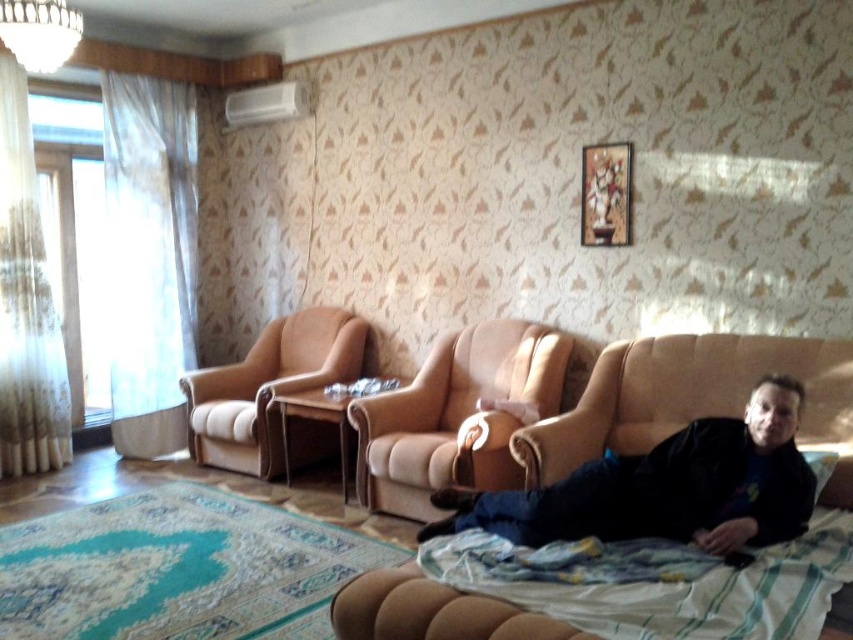
Question: Can you confirm if suede beige armchair at center is positioned to the right of beige fabric armchair at center?

Choices:
 (A) yes
 (B) no

Answer: (A)

Question: Which of the following is the farthest from the observer?

Choices:
 (A) (274, 451)
 (B) (398, 444)

Answer: (A)

Question: Which point is farther from the camera taking this photo?

Choices:
 (A) (627, 557)
 (B) (451, 404)
 (C) (660, 348)

Answer: (B)

Question: Which point appears farthest from the camera in this image?

Choices:
 (A) (625, 448)
 (B) (811, 560)
 (C) (247, 440)

Answer: (C)

Question: Is black matte shirt at lower right behind beige fabric couch at lower right?

Choices:
 (A) no
 (B) yes

Answer: (A)

Question: Can you confirm if suede beige armchair at center is bigger than beige fabric armchair at center?

Choices:
 (A) yes
 (B) no

Answer: (B)